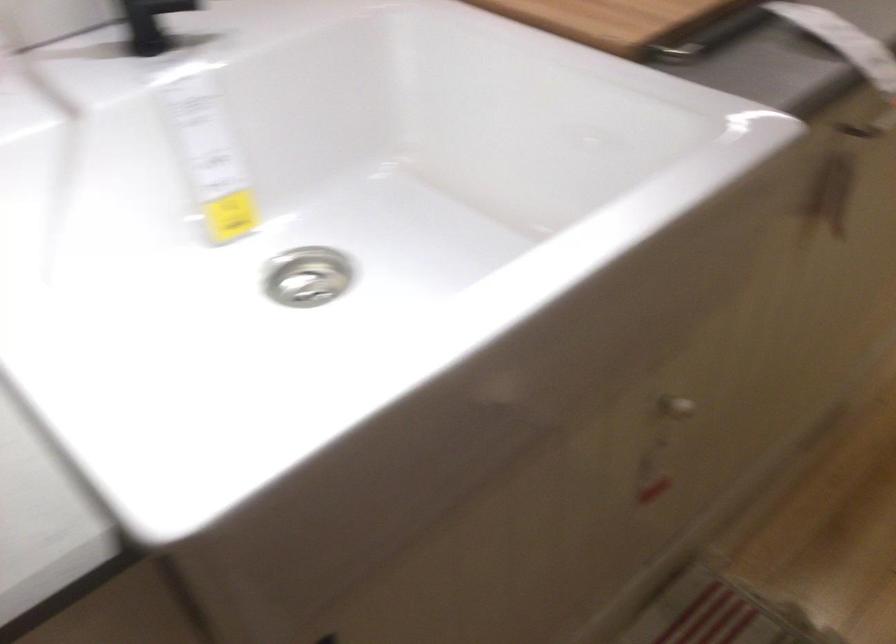
Image resolution: width=896 pixels, height=644 pixels. Find the location of `metal sink drain`. metal sink drain is located at coordinates (306, 277).